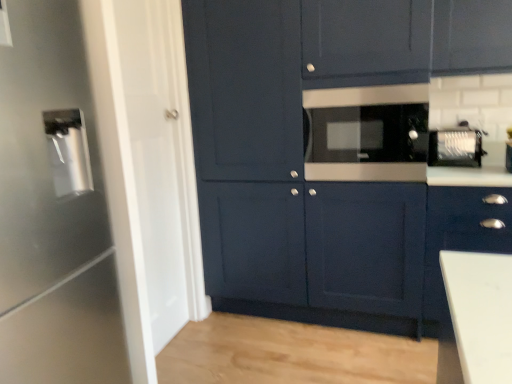
Question: Is satin silver toaster at upper right, the first appliance viewed from the back, positioned with its back to satin black microwave at center, which is the 2th appliance from front to back?

Choices:
 (A) yes
 (B) no

Answer: (B)

Question: Is satin silver toaster at upper right, which ranks as the 3th appliance in left-to-right order, at the left side of satin black microwave at center, the second appliance from the back?

Choices:
 (A) no
 (B) yes

Answer: (A)

Question: Is satin silver toaster at upper right, which ranks as the 3th appliance in front-to-back order, wider than satin black microwave at center, which is the 2th appliance from front to back?

Choices:
 (A) no
 (B) yes

Answer: (A)

Question: From a real-world perspective, does satin silver toaster at upper right, which ranks as the 3th appliance in front-to-back order, sit lower than satin black microwave at center, the second appliance when ordered from right to left?

Choices:
 (A) yes
 (B) no

Answer: (A)

Question: Is satin silver toaster at upper right, the first appliance viewed from the back, further to the viewer compared to satin black microwave at center, the second appliance when ordered from right to left?

Choices:
 (A) yes
 (B) no

Answer: (A)

Question: Is satin silver toaster at upper right, the first appliance viewed from the back, bigger than satin black microwave at center, which is the 2th appliance from front to back?

Choices:
 (A) yes
 (B) no

Answer: (B)

Question: Does satin silver water dispenser at left, which ranks as the 1th appliance in front-to-back order, have a lesser height compared to matte dark blue cabinet at center, arranged as the first cabinetry when viewed from the left?

Choices:
 (A) no
 (B) yes

Answer: (B)

Question: Can you confirm if satin silver water dispenser at left, which ranks as the 3th appliance in back-to-front order, is smaller than matte dark blue cabinet at center, which is counted as the 2th cabinetry, starting from the right?

Choices:
 (A) no
 (B) yes

Answer: (B)

Question: From a real-world perspective, is satin silver water dispenser at left, which ranks as the 1th appliance in front-to-back order, positioned under matte dark blue cabinet at center, arranged as the first cabinetry when viewed from the left, based on gravity?

Choices:
 (A) no
 (B) yes

Answer: (B)

Question: Can you confirm if satin silver water dispenser at left, which is counted as the 3th appliance, starting from the right, is wider than matte dark blue cabinet at center, which is counted as the 2th cabinetry, starting from the right?

Choices:
 (A) no
 (B) yes

Answer: (A)

Question: Is satin silver water dispenser at left, which ranks as the 1th appliance in front-to-back order, not close to matte dark blue cabinet at center, arranged as the first cabinetry when viewed from the left?

Choices:
 (A) yes
 (B) no

Answer: (A)

Question: Can you confirm if satin silver water dispenser at left, which ranks as the 1th appliance in front-to-back order, is taller than matte dark blue cabinet at center, arranged as the first cabinetry when viewed from the left?

Choices:
 (A) no
 (B) yes

Answer: (A)

Question: Considering the relative sizes of satin silver water dispenser at left, which is counted as the 3th appliance, starting from the right, and satin silver toaster at upper right, the 1th appliance from the right, in the image provided, is satin silver water dispenser at left, which is counted as the 3th appliance, starting from the right, taller than satin silver toaster at upper right, the 1th appliance from the right,?

Choices:
 (A) yes
 (B) no

Answer: (A)